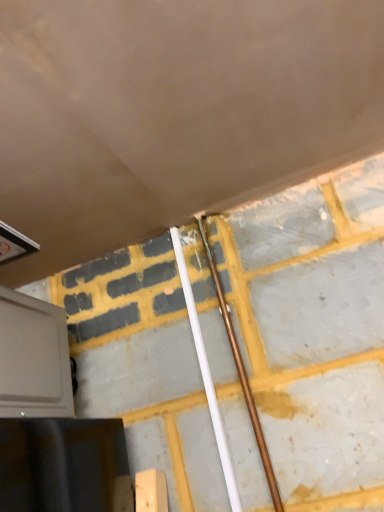
Question: Is white plastic pipe at center, the second beam when ordered from right to left, inside or outside of gray matte oven at lower left?

Choices:
 (A) outside
 (B) inside

Answer: (A)

Question: Is white plastic pipe at center, the 1th beam from the left, bigger or smaller than gray matte oven at lower left?

Choices:
 (A) small
 (B) big

Answer: (A)

Question: Which object is positioned closest to the gray matte oven at lower left?

Choices:
 (A) white plastic pipe at center, the second beam when ordered from right to left
 (B) copper metallic pipe at center, placed as the 1th beam when sorted from right to left

Answer: (A)

Question: Considering the real-world distances, which object is closest to the white plastic pipe at center, the 1th beam from the left?

Choices:
 (A) gray matte oven at lower left
 (B) copper metallic pipe at center, placed as the 1th beam when sorted from right to left

Answer: (B)